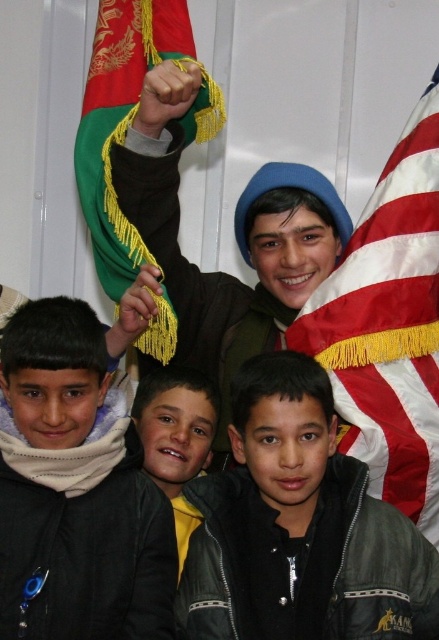
Which is in front, point (374, 536) or point (370, 435)?

Point (374, 536)

How distant is dark green jacket at lower right from american flag at right?

A distance of 17.09 inches exists between dark green jacket at lower right and american flag at right.

This screenshot has height=640, width=439. What do you see at coordinates (302, 529) in the screenshot? I see `dark green jacket at lower right` at bounding box center [302, 529].

Find the location of a particular element. The width and height of the screenshot is (439, 640). dark green jacket at lower right is located at coordinates (302, 529).

From the picture: Between dark green jacket at lower right and yellow fleece jacket at center, which one appears on the right side from the viewer's perspective?

dark green jacket at lower right is more to the right.

Describe the element at coordinates (302, 529) in the screenshot. I see `dark green jacket at lower right` at that location.

Is point (366, 618) closer to camera compared to point (183, 556)?

Yes, it is in front of point (183, 556).

This screenshot has height=640, width=439. I want to click on dark green jacket at lower right, so click(302, 529).

Does dark green jacket at lower right have a lesser width compared to green fabric flag at upper left?

No, dark green jacket at lower right is not thinner than green fabric flag at upper left.

Does dark green jacket at lower right have a greater width compared to green fabric flag at upper left?

Yes, dark green jacket at lower right is wider than green fabric flag at upper left.

Locate an element on the screen. The width and height of the screenshot is (439, 640). dark green jacket at lower right is located at coordinates (302, 529).

I want to click on dark green jacket at lower right, so click(x=302, y=529).